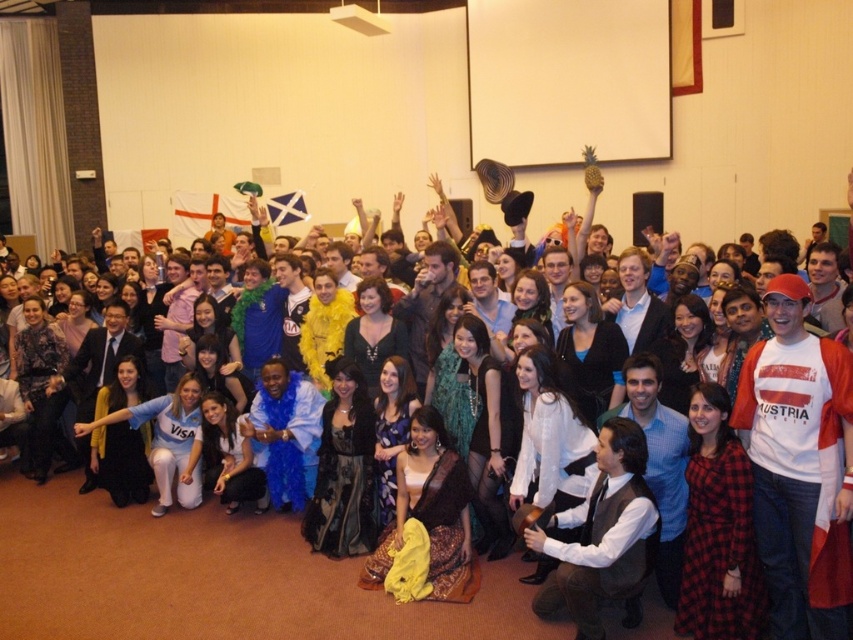
You are a photographer at the event and want to capture both the black satin dress at center and the teal sequined dress at center in a single frame. Given that your camera has a minimum focus distance of 1 meter, will you be able to achieve this?

The black satin dress at center and teal sequined dress at center are 76.91 centimeters apart from each other. Since 76.91 cm is less than 1 meter, the camera can focus on both dresses simultaneously within the frame.

You are organizing a photoshoot and need to place a 1.2 meter wide backdrop behind the white shirt at center and the yellow sheer fabric at center. Based on their widths, which object should be placed closer to the edge of the backdrop to ensure both fit?

The yellow sheer fabric at center should be placed closer to the edge of the backdrop because its width is smaller than the white shirt at center, allowing more space for the wider white shirt at center to fit within the 1.2 meter backdrop.